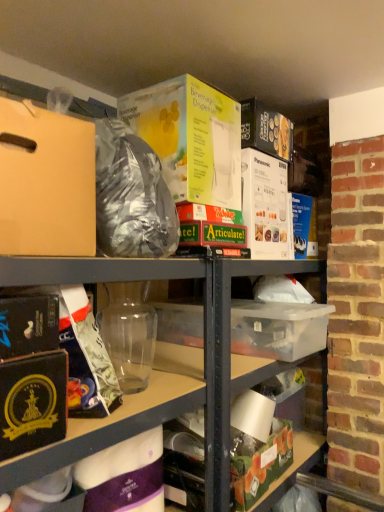
Question: Is matte gold wrapping paper at left, arranged as the 1th wrapping paper when viewed from the top, taller or shorter than matte cardboard box at upper left?

Choices:
 (A) short
 (B) tall

Answer: (B)

Question: Is matte gold wrapping paper at left, arranged as the 1th wrapping paper when viewed from the top, wider or thinner than matte cardboard box at upper left?

Choices:
 (A) thin
 (B) wide

Answer: (A)

Question: Estimate the real-world distances between objects in this image. Which object is closer to the purple matte wrapping paper at lower center, which is the 1th wrapping paper in bottom-to-top order?

Choices:
 (A) matte gold wrapping paper at left, arranged as the 1th wrapping paper when viewed from the top
 (B) transparent plastic container at center
 (C) yellow cardboard beverage dispenser at upper center, which is the first paperback book from top to bottom
 (D) matte cardboard box at upper left
 (E) green matte box at lower center

Answer: (B)

Question: Which is nearer to the black matte book at lower left, acting as the 2th paperback book starting from the top?

Choices:
 (A) transparent plastic container at center
 (B) purple matte wrapping paper at lower center, the 2th wrapping paper when ordered from top to bottom
 (C) yellow cardboard beverage dispenser at upper center, which is the first paperback book from top to bottom
 (D) matte cardboard box at upper left
 (E) matte gold wrapping paper at left, arranged as the 1th wrapping paper when viewed from the top

Answer: (E)